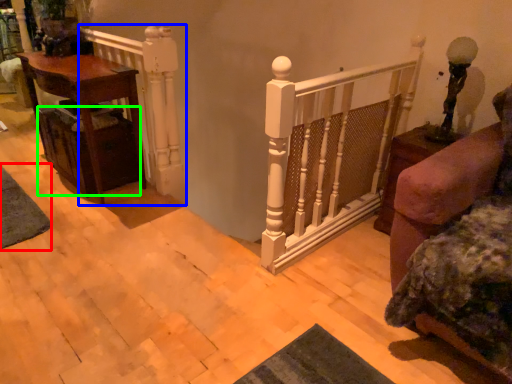
Question: Which is nearer to the mat (highlighted by a red box)? rail (highlighted by a blue box) or drawer (highlighted by a green box).

Choices:
 (A) rail
 (B) drawer

Answer: (B)